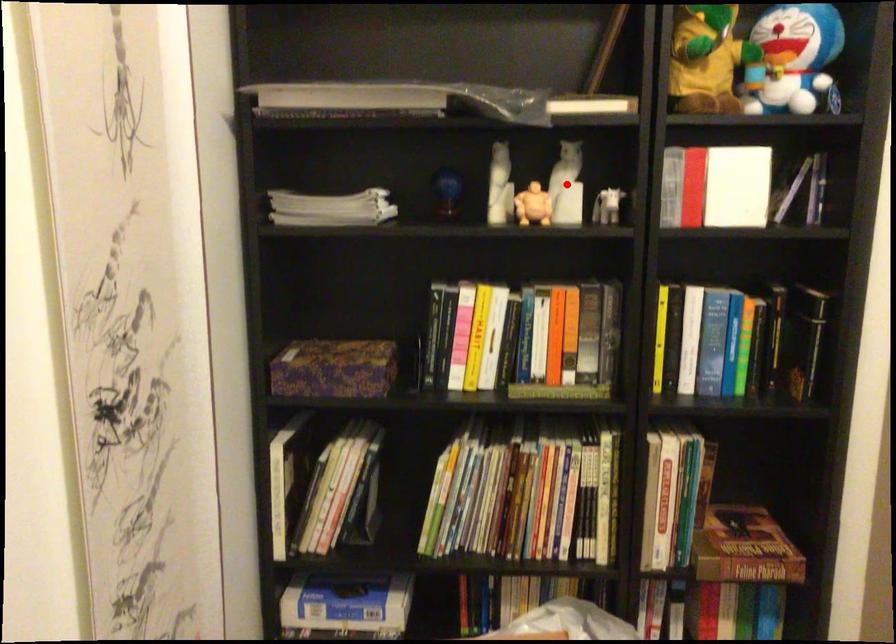
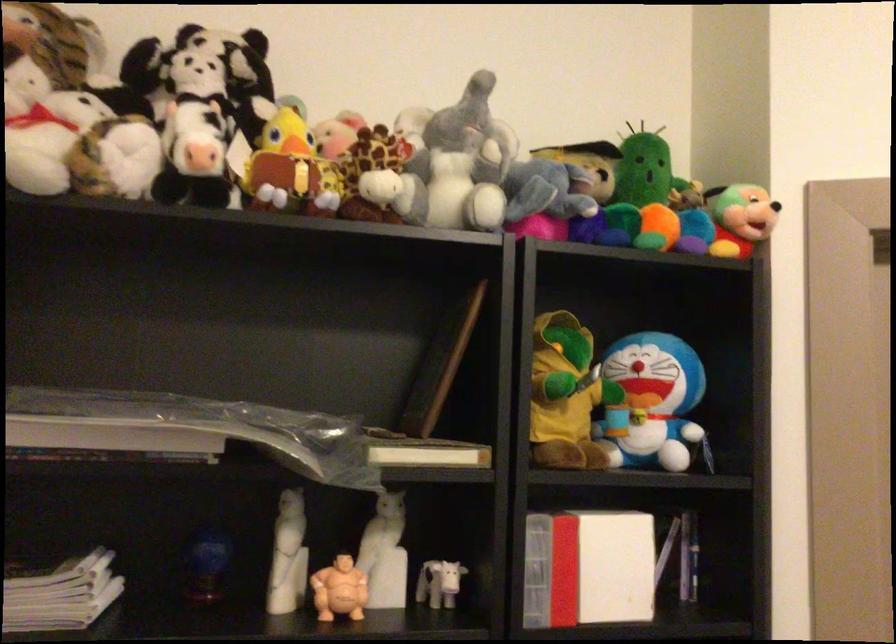
Question: I am providing you with two images of the same scene from different viewpoints. Image1 has a red point marked. In image2, the corresponding 3D location appears at what relative position? Reply with the corresponding letter.

Choices:
 (A) Closer
 (B) Farther

Answer: (A)